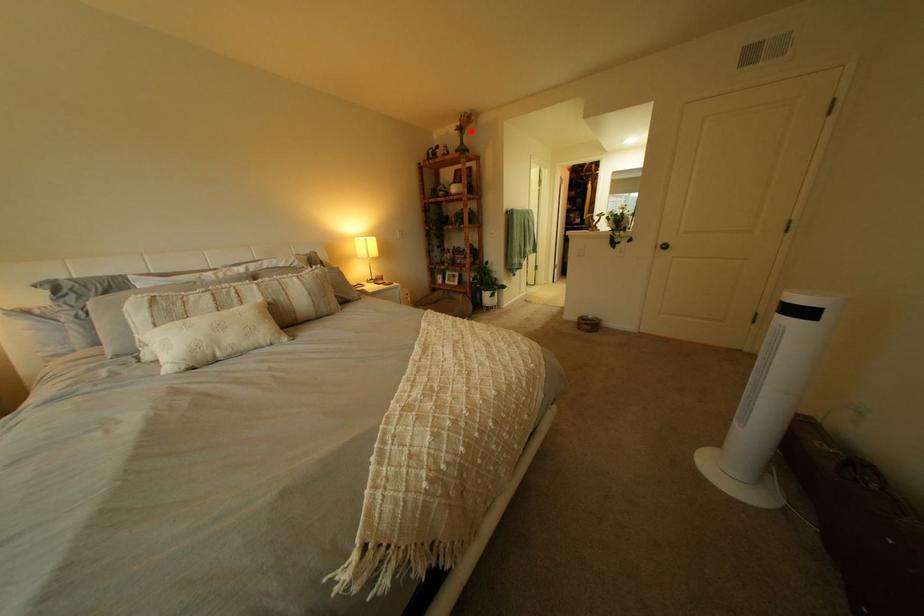
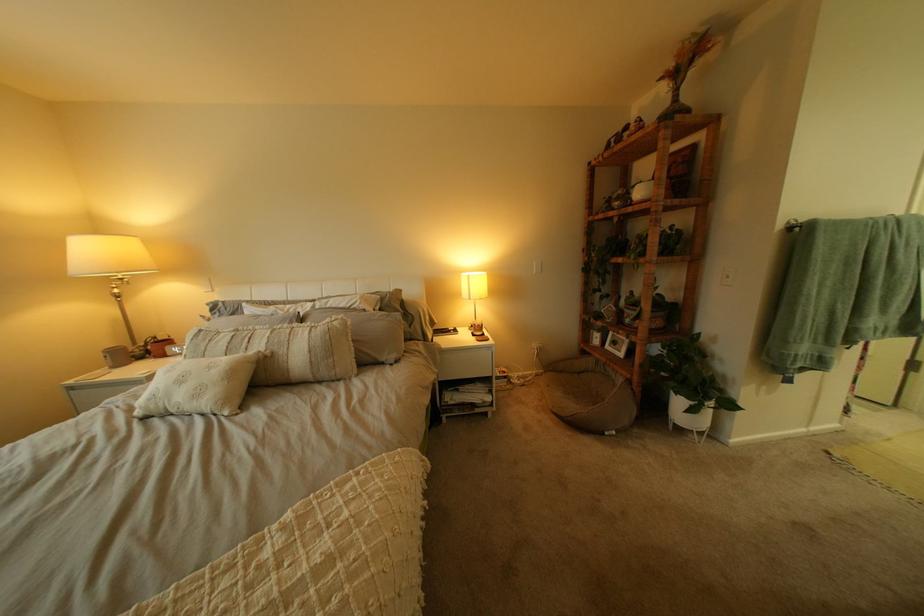
Question: I am providing you with two images of the same scene from different viewpoints. A red point is shown in image1. For the corresponding object point in image2, is it positioned nearer or farther from the camera?

Choices:
 (A) Nearer
 (B) Farther

Answer: (B)